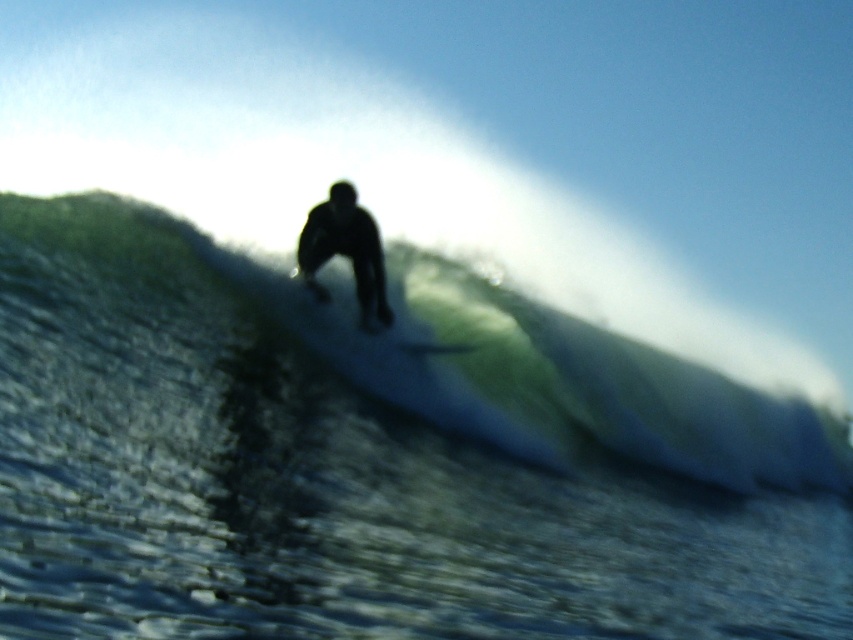
Question: Among these objects, which one is farthest from the camera?

Choices:
 (A) black matte surfboard at center
 (B) green rubber surfboard at center
 (C) smooth white surfboard at center

Answer: (A)

Question: Which point is farther from the camera taking this photo?

Choices:
 (A) (514, 304)
 (B) (412, 346)
 (C) (311, 276)

Answer: (A)

Question: Is green rubber surfboard at center below black matte surfboard at center?

Choices:
 (A) yes
 (B) no

Answer: (A)

Question: Which object is farther from the camera taking this photo?

Choices:
 (A) green rubber surfboard at center
 (B) black matte surfboard at center

Answer: (B)

Question: Can you confirm if black matte surfboard at center is bigger than smooth white surfboard at center?

Choices:
 (A) no
 (B) yes

Answer: (B)

Question: Is green rubber surfboard at center further to camera compared to smooth white surfboard at center?

Choices:
 (A) yes
 (B) no

Answer: (B)